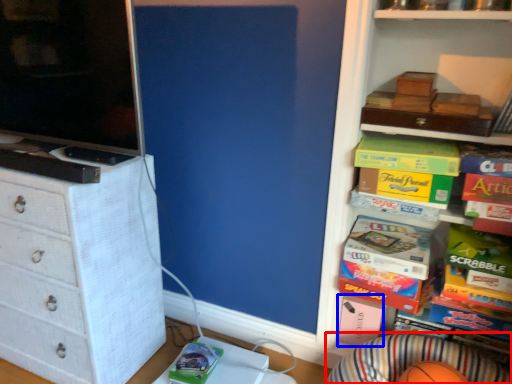
Question: Which of the following is the farthest to the observer, plain (highlighted by a red box) or box (highlighted by a blue box)?

Choices:
 (A) plain
 (B) box

Answer: (B)